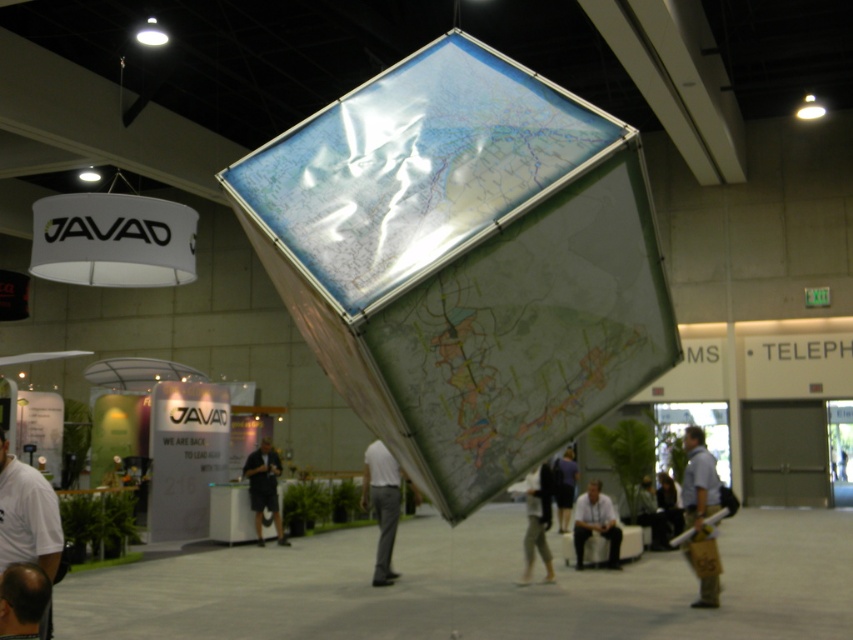
Question: Estimate the real-world distances between objects in this image. Which object is closer to the smooth bald head at lower left?

Choices:
 (A) light blue shirt at lower right
 (B) dark gray shorts at center
 (C) light gray shirt at lower center
 (D) dark blue shirt at center

Answer: (A)

Question: Can you confirm if khaki pants at center is smaller than light gray shirt at lower center?

Choices:
 (A) yes
 (B) no

Answer: (B)

Question: Which object is closer to the camera taking this photo?

Choices:
 (A) khaki pants at center
 (B) white t-shirt at lower left
 (C) dark gray shorts at center

Answer: (B)

Question: Can you confirm if white t-shirt at lower left is positioned below khaki pants at center?

Choices:
 (A) no
 (B) yes

Answer: (A)

Question: Can you confirm if khaki pants at center is positioned above dark blue shirt at center?

Choices:
 (A) no
 (B) yes

Answer: (B)

Question: Which of the following is the closest to the observer?

Choices:
 (A) white matte shirt at center
 (B) khaki pants at center
 (C) light gray shirt at lower center

Answer: (B)